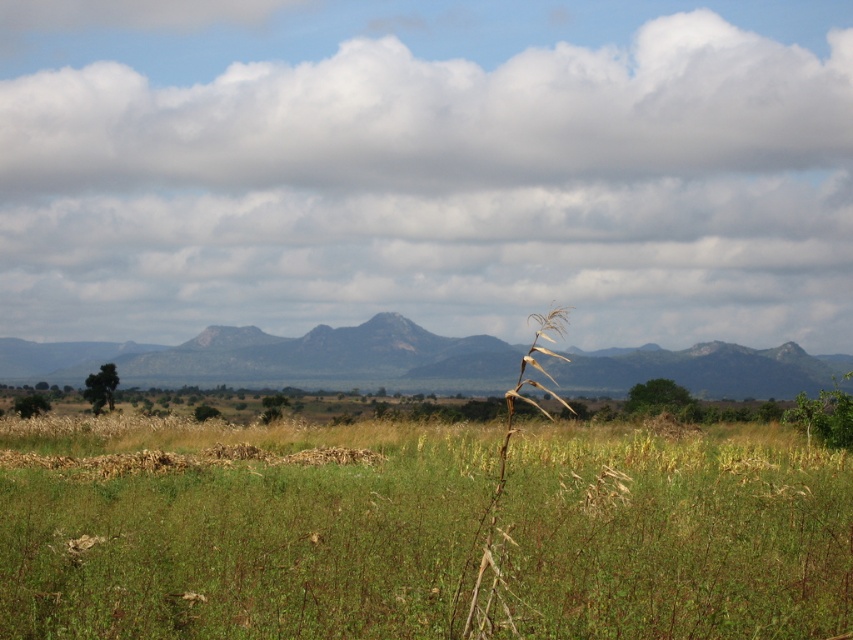
You are a hiker planning to take a photo of the rocky gray mountain at center from the field of green vegetation in the foreground. Based on the coordinates provided, where should you position yourself relative to the mountain to ensure it is centered in your photo?

The rocky gray mountain at center is already positioned at the coordinates provided, so you should position yourself directly in front of it to ensure it is centered in your photo.

You are standing in the middle of the field and see the rocky gray mountain at center and the brown dry stalk at center. Which object is positioned to the left when viewed from your current position?

The rocky gray mountain at center is to the left of the brown dry stalk at center.